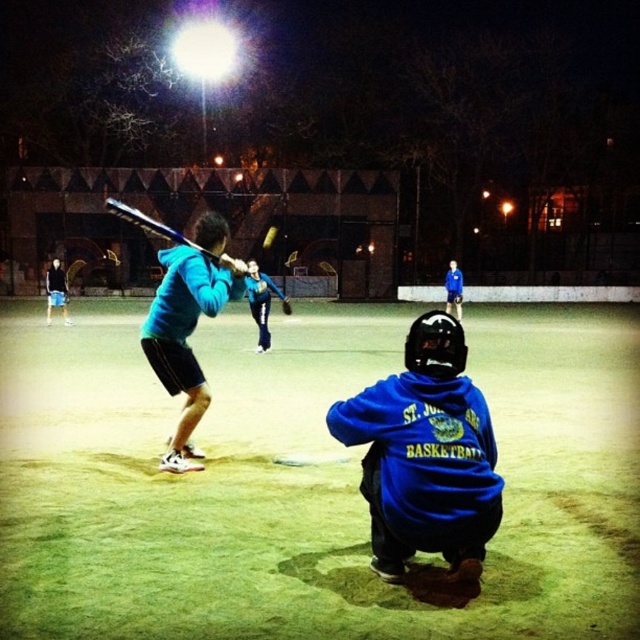
You are a coach standing at the edge of the baseball field. You need to retrieve both the blue fleece jacket at lower center and the shiny blue bat at center for the next practice. If you start at the edge of the field, which item should you reach first, and why?

The blue fleece jacket at lower center is closer to the edge of the field than the shiny blue bat at center. Since the jacket is only 4.13 meters away from the bat, but the exact distance from the edge isn